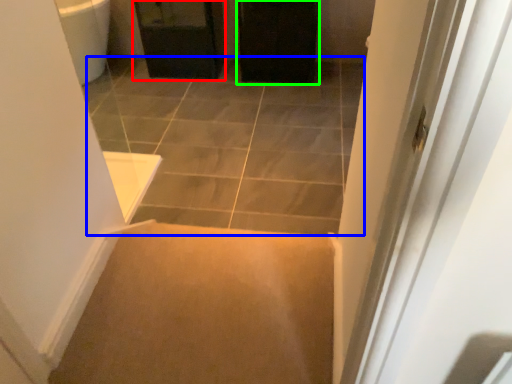
Question: Estimate the real-world distances between objects in this image. Which object is farther from cabinetry (highlighted by a red box), path (highlighted by a blue box) or screen door (highlighted by a green box)?

Choices:
 (A) path
 (B) screen door

Answer: (A)